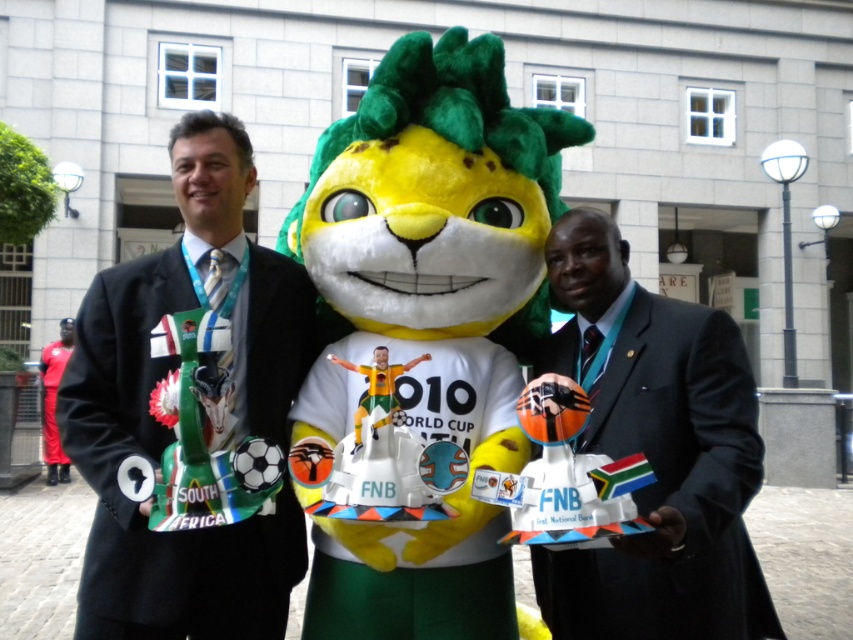
You are a photographer trying to capture a photo of the soft plush lion at center and the dark gray suit at center. Since you want both subjects to appear equally prominent in the photo, which subject should you move closer to the camera?

The soft plush lion at center is larger in size than the dark gray suit at center, so you should move closer to the dark gray suit at center to make it appear larger and balance the prominence of both subjects in the photo.

You are a photographer trying to capture a clear photo of the dark gray suit at center without the soft plush lion at center blocking it. How should you adjust your position?

Move forward so that the dark gray suit at center is no longer blocked by the soft plush lion at center.